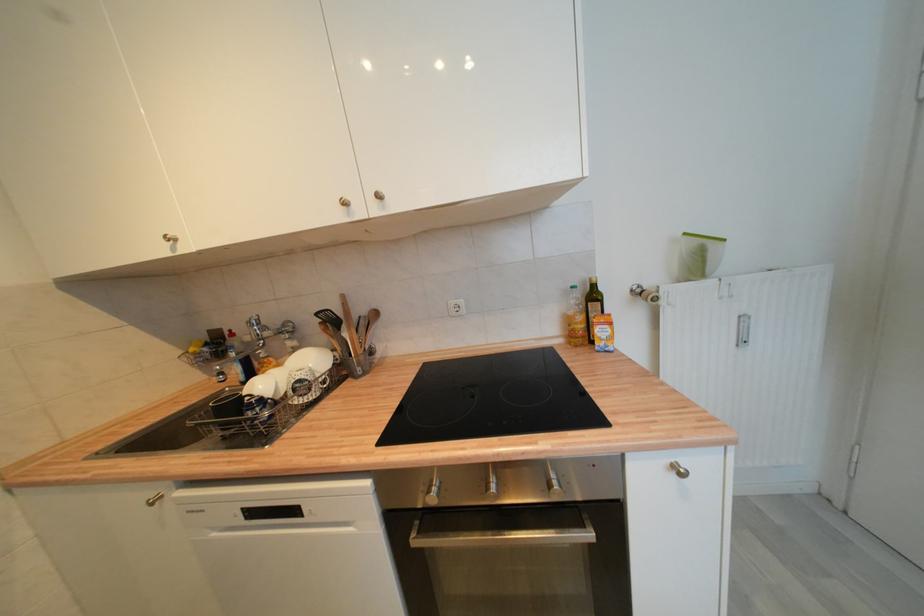
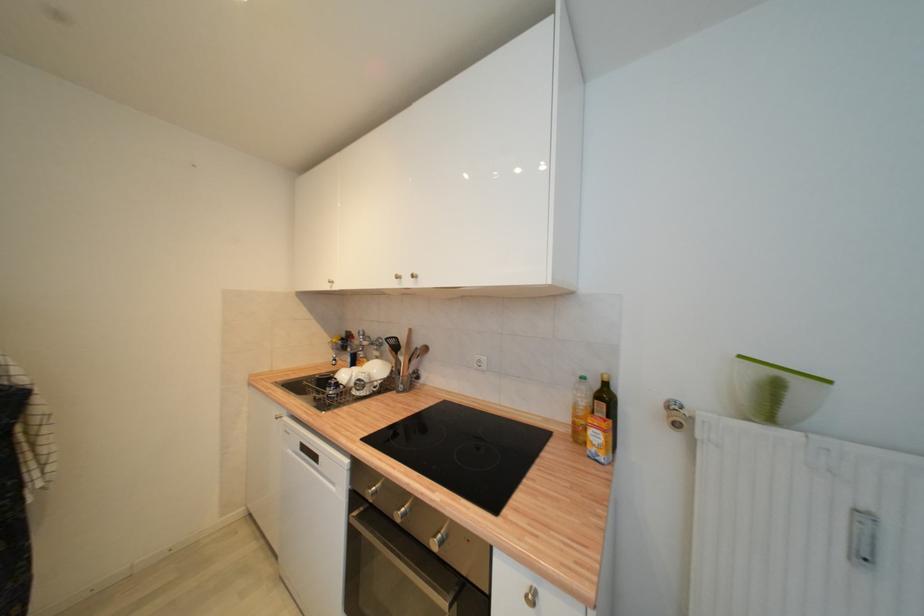
The point at (747, 344) is marked in the first image. Where is the corresponding point in the second image?

(869, 560)